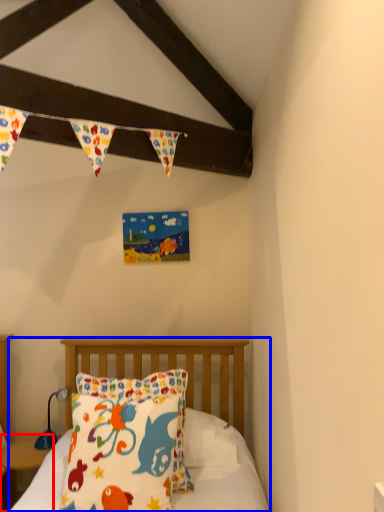
Question: Among these objects, which one is farthest to the camera, nightstand (highlighted by a red box) or bed (highlighted by a blue box)?

Choices:
 (A) nightstand
 (B) bed

Answer: (A)